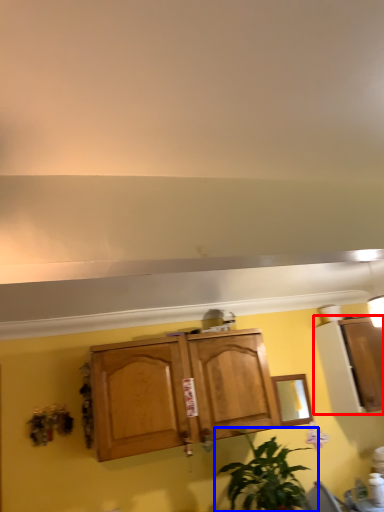
Question: Which object appears closest to the camera in this image, cabinetry (highlighted by a red box) or houseplant (highlighted by a blue box)?

Choices:
 (A) cabinetry
 (B) houseplant

Answer: (B)